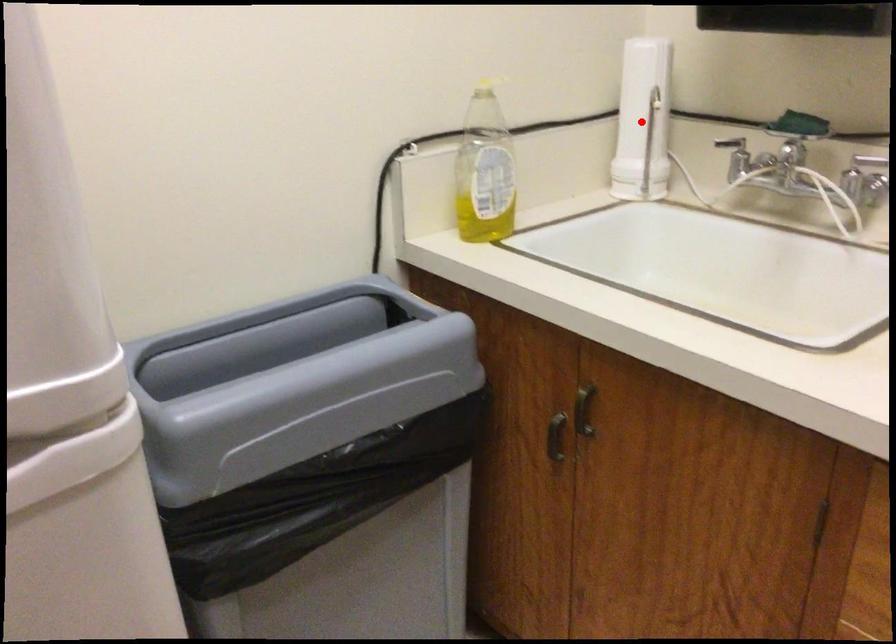
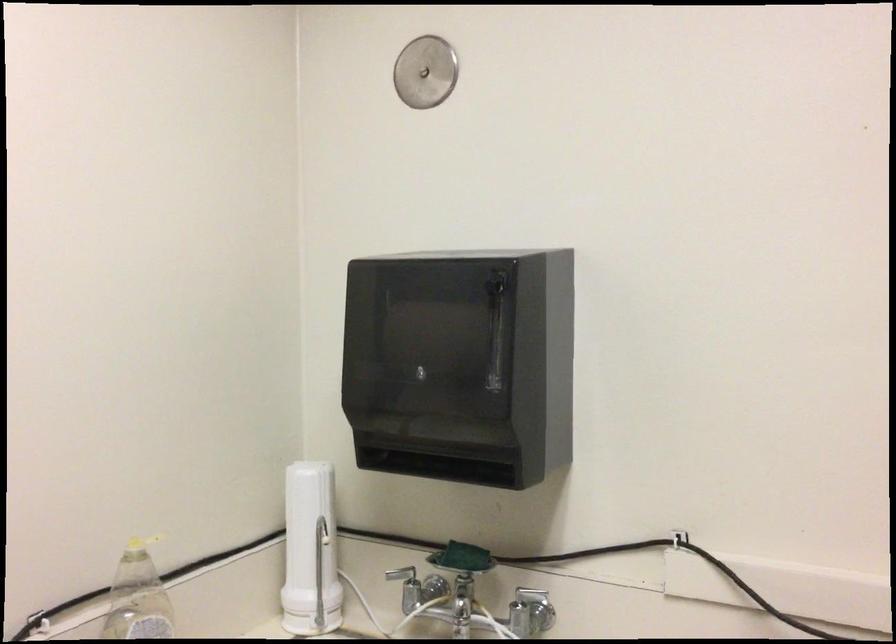
Locate, in the second image, the point that corresponds to the highlighted location in the first image.

(309, 551)